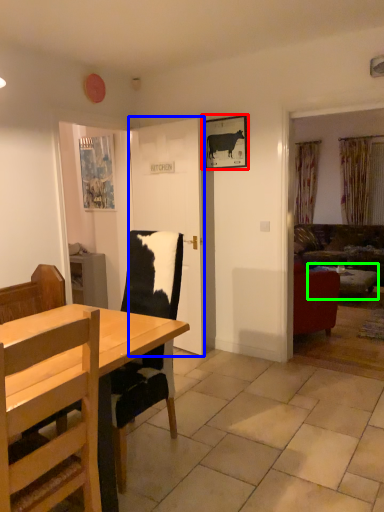
Question: Which object is the farthest from picture frame (highlighted by a red box)? Choose among these: door (highlighted by a blue box) or table (highlighted by a green box).

Choices:
 (A) door
 (B) table

Answer: (B)